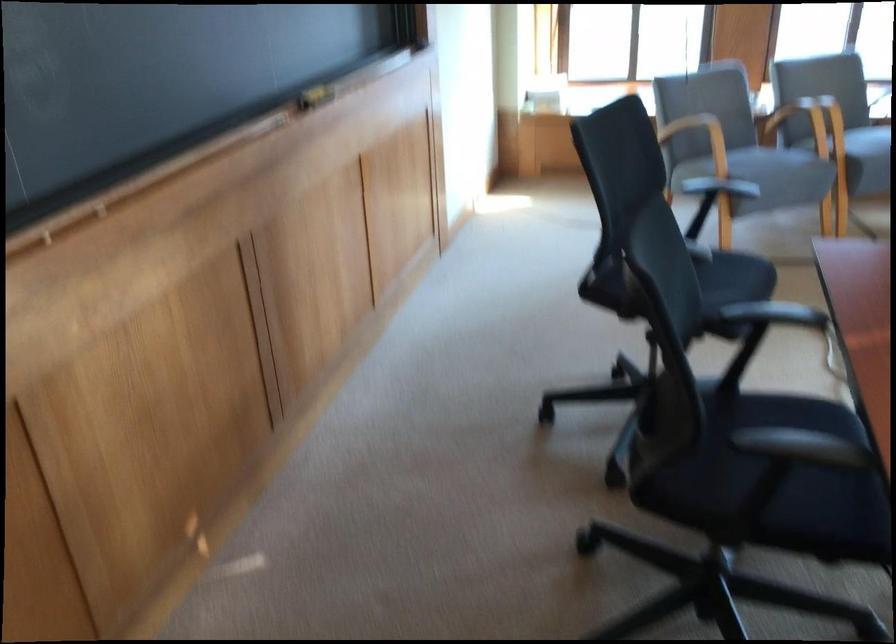
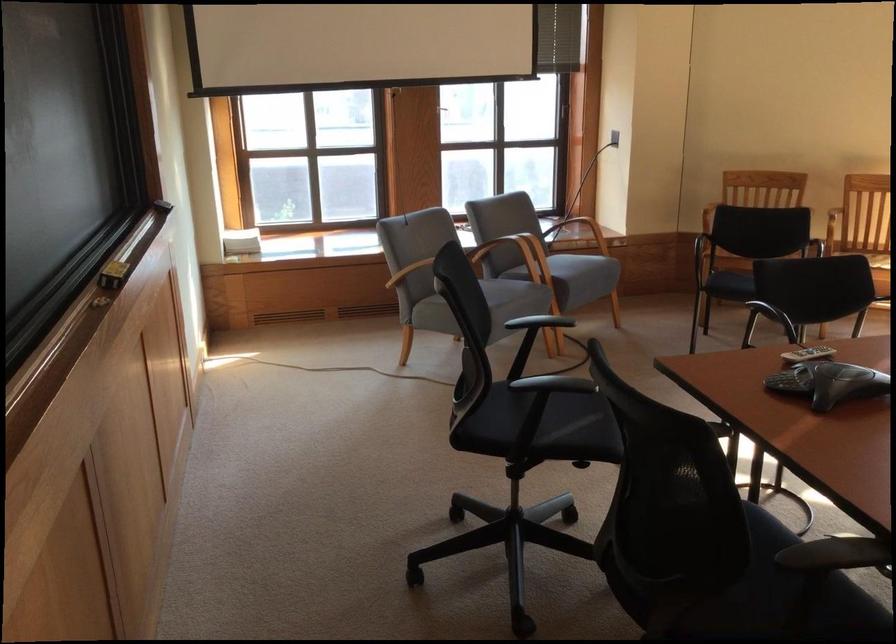
Question: How did the camera likely rotate?

Choices:
 (A) Left
 (B) Right
 (C) Up
 (D) Down

Answer: (B)